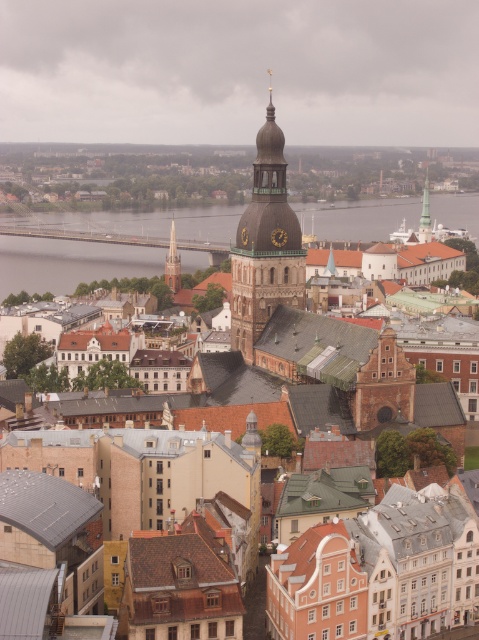
Is matte brown tower at center thinner than green copper spire at upper center?

No.

Is matte brown tower at center smaller than green copper spire at upper center?

No, matte brown tower at center is not smaller than green copper spire at upper center.

This screenshot has width=479, height=640. What do you see at coordinates (132, 172) in the screenshot? I see `matte brown tower at center` at bounding box center [132, 172].

Find the location of `matte brown tower at center`. matte brown tower at center is located at coordinates (132, 172).

What do you see at coordinates (132, 172) in the screenshot? Image resolution: width=479 pixels, height=640 pixels. I see `matte brown tower at center` at bounding box center [132, 172].

Is matte brown tower at center above gold textured clock tower at center?

Actually, matte brown tower at center is below gold textured clock tower at center.

Which is in front, point (371, 177) or point (286, 280)?

Point (286, 280) is more forward.

Locate an element on the screen. matte brown tower at center is located at coordinates (132, 172).

Measure the distance between gold textured clock tower at center and camera.

The distance of gold textured clock tower at center from camera is 190.90 meters.

Is gold textured clock tower at center above smooth silver spire at center?

Yes.

Where is `gold textured clock tower at center`? This screenshot has width=479, height=640. gold textured clock tower at center is located at coordinates click(x=265, y=244).

You are a GUI agent. You are given a task and a screenshot of the screen. Output one action in this format:
    pyautogui.click(x=<x>, y=<y>)
    Task: Click on the gold textured clock tower at center
    
    Given the screenshot: What is the action you would take?
    pyautogui.click(x=265, y=244)